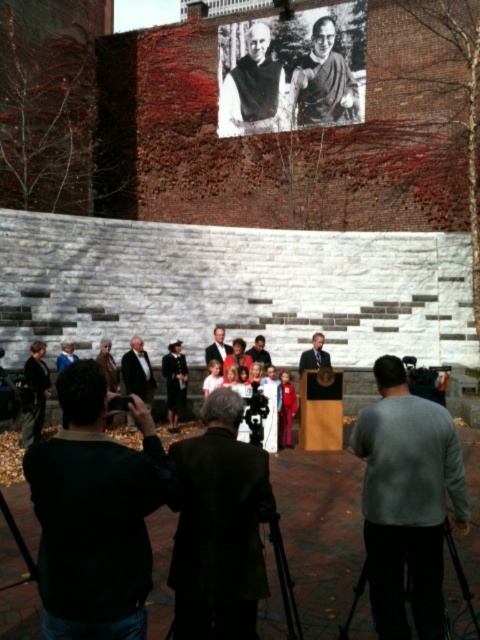
You are attending an outdoor event and want to take a photo of the speaker in the dark suit at center without including the black and white photograph of man at upper center in the background. Is this possible?

The black and white photograph of man at upper center is positioned on the right side of dark suit at center, so if you move to the left side of the dark suit at center, you can frame the photo to exclude the photograph in the background.

From the picture: What is the exact coordinate of the black and white photograph of man at upper center?

The black and white photograph of man at upper center is located at point (253, 90).